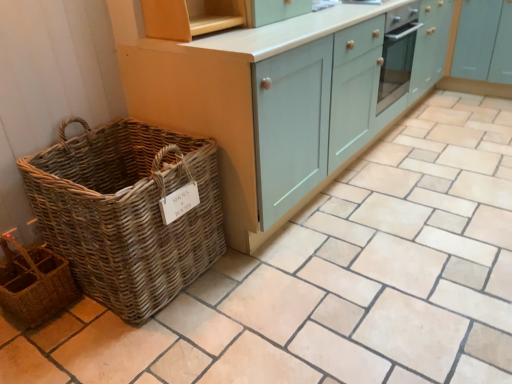
Question: Does point (54, 301) appear closer or farther from the camera than point (194, 72)?

Choices:
 (A) closer
 (B) farther

Answer: (B)

Question: Considering the positions of rustic wicker basket at lower left and matte teal cabinet at center, which is the second cabinetry from right to left, in the image, is rustic wicker basket at lower left taller or shorter than matte teal cabinet at center, which is the second cabinetry from right to left,?

Choices:
 (A) short
 (B) tall

Answer: (A)

Question: Which object is the closest to the matte teal cabinet at center, which is the second cabinetry from right to left?

Choices:
 (A) rustic wicker basket at lower left
 (B) light blue wood cabinet at upper right, which is counted as the first cabinetry, starting from the right
 (C) wooden shelf at upper center
 (D) woven brown basket at left

Answer: (C)

Question: Which object is positioned closest to the light blue wood cabinet at upper right, which ranks as the second cabinetry in left-to-right order?

Choices:
 (A) woven brown basket at left
 (B) rustic wicker basket at lower left
 (C) wooden shelf at upper center
 (D) matte teal cabinet at center, which is counted as the first cabinetry, starting from the left

Answer: (D)